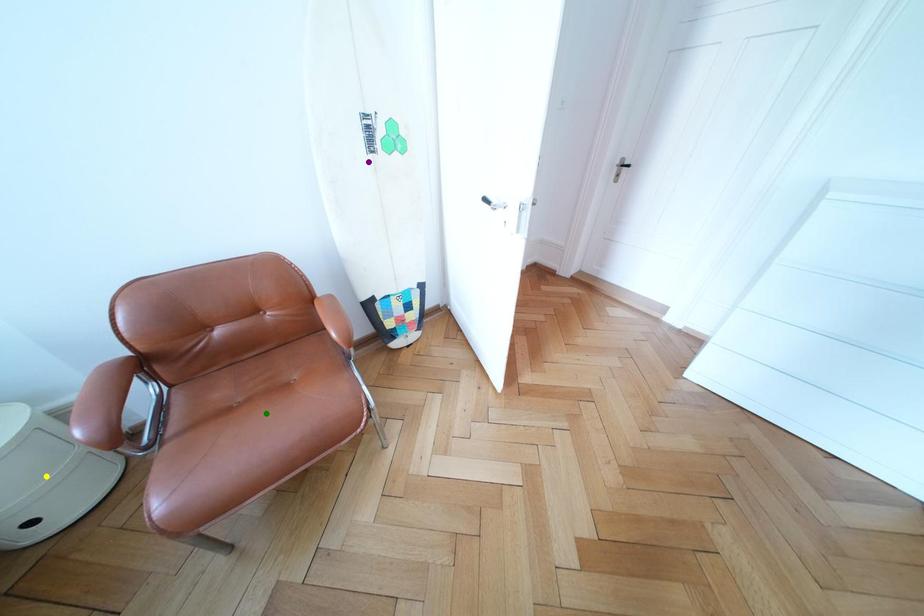
Order these from farthest to nearest:
A) yellow point
B) green point
C) purple point

purple point
green point
yellow point